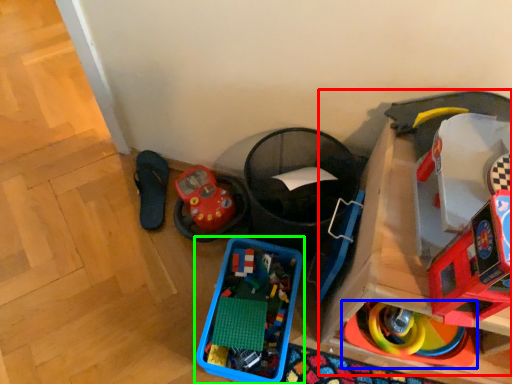
Question: Which is nearer to the toy (highlighted by a red box)? toy (highlighted by a blue box) or toy (highlighted by a green box).

Choices:
 (A) toy
 (B) toy

Answer: (A)